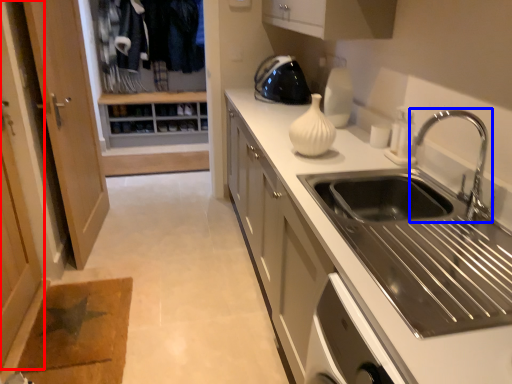
Question: Among these objects, which one is nearest to the camera, screen door (highlighted by a red box) or tap (highlighted by a blue box)?

Choices:
 (A) screen door
 (B) tap

Answer: (B)